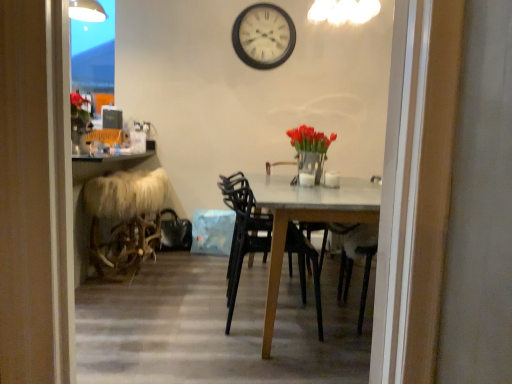
Question: From a real-world perspective, is furry white folding chair at left on top of white matte wall clock at upper center?

Choices:
 (A) yes
 (B) no

Answer: (B)

Question: Can white matte wall clock at upper center be found inside furry white folding chair at left?

Choices:
 (A) no
 (B) yes

Answer: (A)

Question: Is furry white folding chair at left oriented away from white matte wall clock at upper center?

Choices:
 (A) yes
 (B) no

Answer: (B)

Question: Does furry white folding chair at left turn towards white matte wall clock at upper center?

Choices:
 (A) no
 (B) yes

Answer: (A)

Question: Is the surface of furry white folding chair at left in direct contact with white matte wall clock at upper center?

Choices:
 (A) yes
 (B) no

Answer: (B)

Question: Is furry white folding chair at left far away from white matte wall clock at upper center?

Choices:
 (A) yes
 (B) no

Answer: (A)

Question: From a real-world perspective, is matte silver vase with red tulips at center on top of transparent glass door at upper left?

Choices:
 (A) yes
 (B) no

Answer: (B)

Question: Does matte silver vase with red tulips at center have a lesser height compared to transparent glass door at upper left?

Choices:
 (A) no
 (B) yes

Answer: (B)

Question: From the image's perspective, is matte silver vase with red tulips at center under transparent glass door at upper left?

Choices:
 (A) yes
 (B) no

Answer: (A)

Question: Would you say matte silver vase with red tulips at center contains transparent glass door at upper left?

Choices:
 (A) yes
 (B) no

Answer: (B)

Question: Can you see matte silver vase with red tulips at center touching transparent glass door at upper left?

Choices:
 (A) yes
 (B) no

Answer: (B)

Question: Is matte silver vase with red tulips at center outside of transparent glass door at upper left?

Choices:
 (A) no
 (B) yes

Answer: (B)

Question: Is transparent glass door at upper left positioned with its back to matte silver vase with red tulips at center?

Choices:
 (A) yes
 (B) no

Answer: (B)